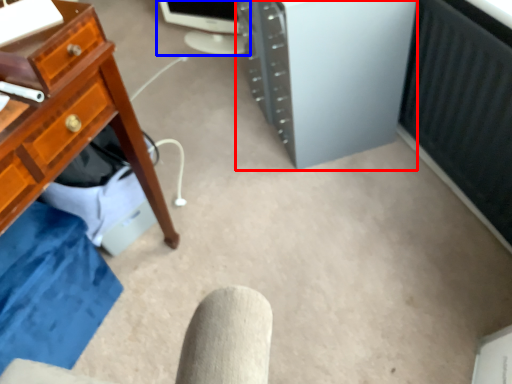
Question: Which object appears farthest to the camera in this image, computer tower (highlighted by a red box) or desktop computer (highlighted by a blue box)?

Choices:
 (A) computer tower
 (B) desktop computer

Answer: (B)